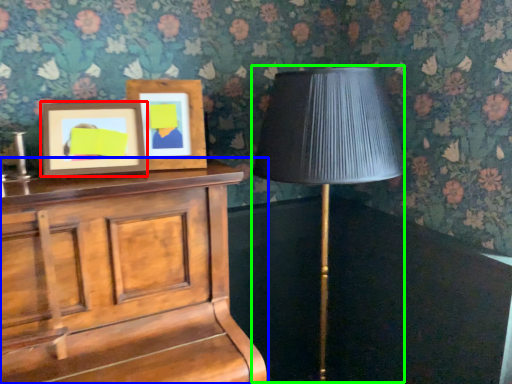
Question: Which object is the farthest from picture frame (highlighted by a red box)? Choose among these: furniture (highlighted by a blue box) or table lamp (highlighted by a green box).

Choices:
 (A) furniture
 (B) table lamp

Answer: (B)